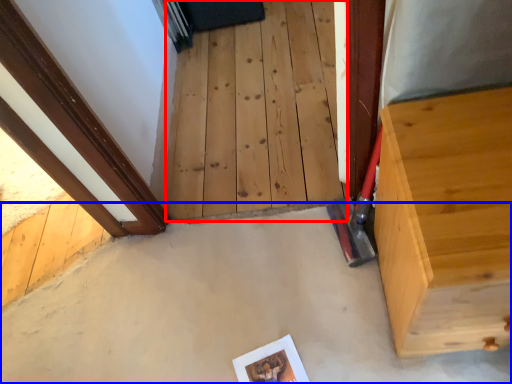
Question: Which object appears farthest to the camera in this image, stairwell (highlighted by a red box) or concrete (highlighted by a blue box)?

Choices:
 (A) stairwell
 (B) concrete

Answer: (A)